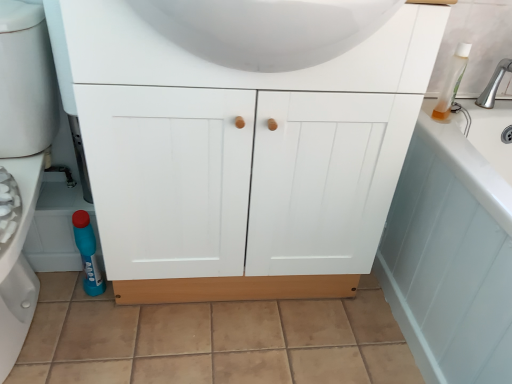
Identify the location of unoccupied region to the right of blue plastic bottle at lower left. This screenshot has width=512, height=384. (144, 309).